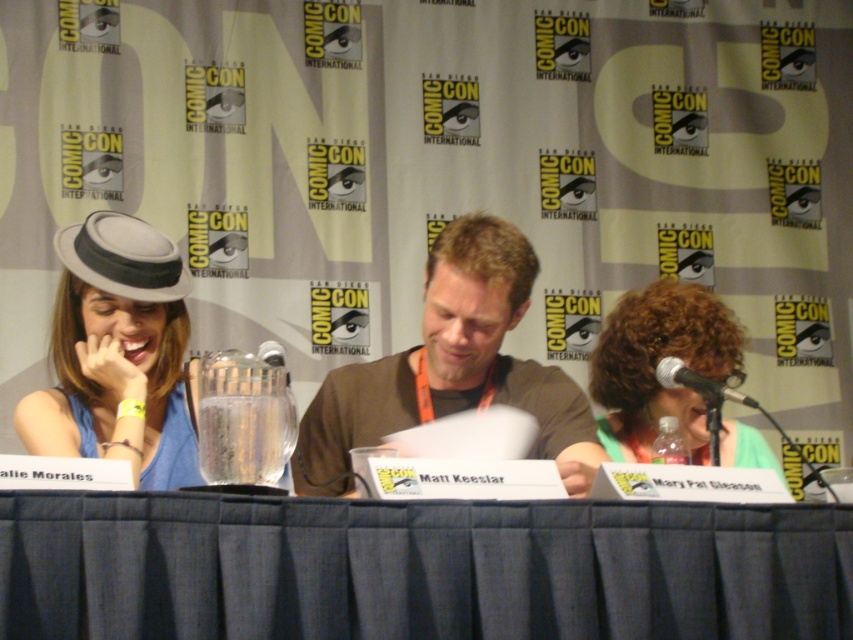
Which of these two, blue fabric table at center or brown cotton shirt at center, stands taller?

Standing taller between the two is brown cotton shirt at center.

Is blue fabric table at center thinner than brown cotton shirt at center?

In fact, blue fabric table at center might be wider than brown cotton shirt at center.

Is point (461, 576) positioned after point (573, 412)?

No, (461, 576) is closer to viewer.

Locate an element on the screen. blue fabric table at center is located at coordinates (416, 568).

Which is behind, point (314, 566) or point (260, 346)?

The point (260, 346) is behind.

The width and height of the screenshot is (853, 640). I want to click on blue fabric table at center, so click(x=416, y=568).

Who is more distant from viewer, (204, 513) or (285, 372)?

The point (285, 372) is behind.

The height and width of the screenshot is (640, 853). In order to click on blue fabric table at center in this screenshot , I will do `click(416, 568)`.

The width and height of the screenshot is (853, 640). What are the coordinates of `matte gray hat at left` in the screenshot? It's located at (119, 355).

Which is more to the right, matte gray hat at left or black metallic microphone at right?

Positioned to the right is black metallic microphone at right.

Does point (68, 284) come behind point (676, 378)?

Yes, point (68, 284) is behind point (676, 378).

At what (x,y) coordinates should I click in order to perform the action: click on matte gray hat at left. Please return your answer as a coordinate pair (x, y). Looking at the image, I should click on (119, 355).